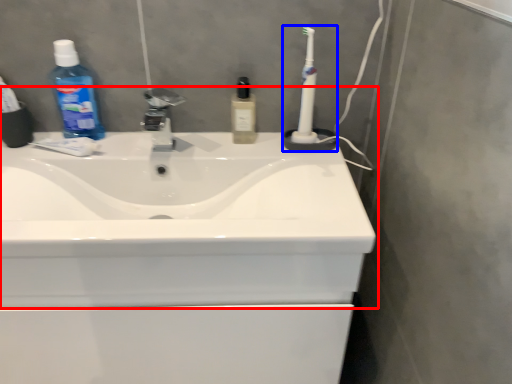
Question: Which of the following is the farthest to the observer, sink (highlighted by a red box) or toothbrush (highlighted by a blue box)?

Choices:
 (A) sink
 (B) toothbrush

Answer: (B)